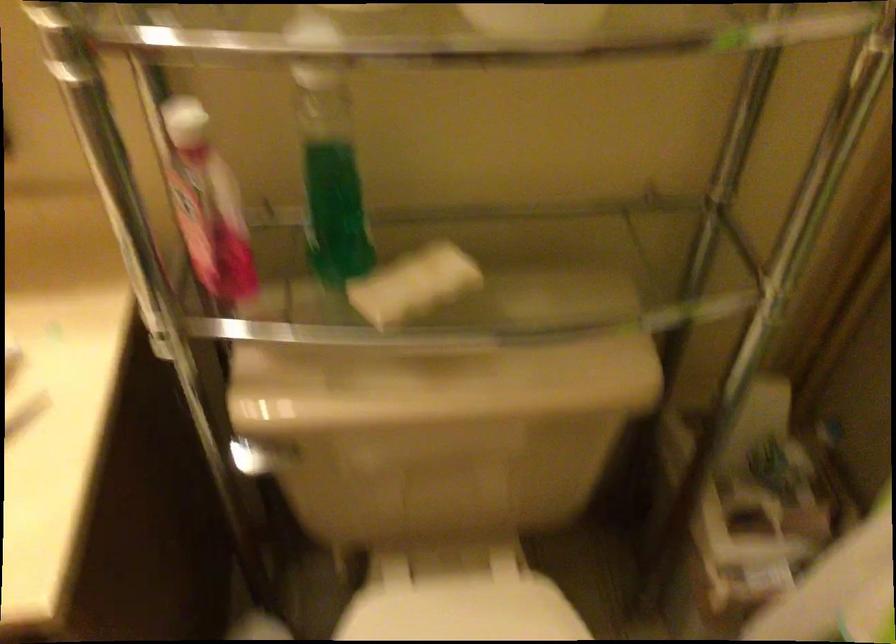
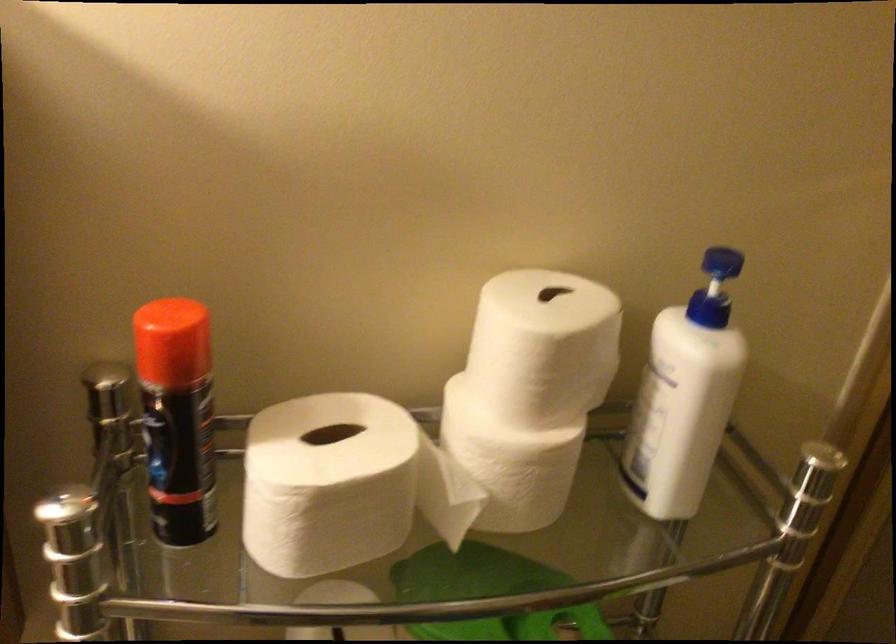
Question: In a continuous first-person perspective shot, in which direction is the camera moving?

Choices:
 (A) Left
 (B) Right
 (C) Forward
 (D) Backward

Answer: (D)